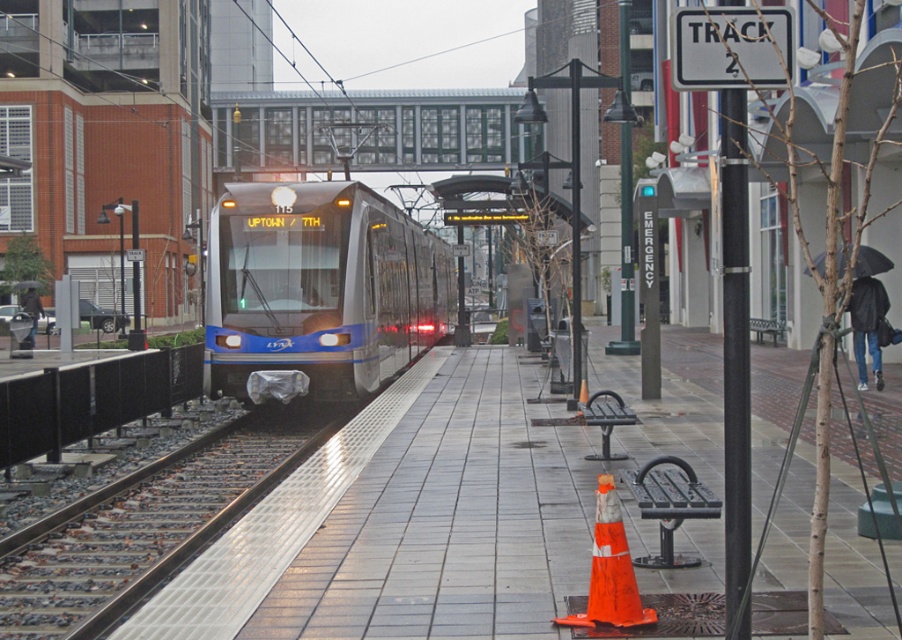
Who is taller, silver metallic train at center or orange matte traffic cone at lower center?

Standing taller between the two is silver metallic train at center.

Which of these two, silver metallic train at center or orange matte traffic cone at lower center, stands shorter?

With less height is orange matte traffic cone at lower center.

Between point (436, 280) and point (615, 500), which one is positioned behind?

The point (436, 280) is more distant.

The height and width of the screenshot is (640, 902). In order to click on silver metallic train at center in this screenshot , I will do `click(319, 289)`.

In the scene shown: Can you confirm if metal/textured track at lower left is shorter than orange matte traffic cone at lower center?

Yes.

Describe the element at coordinates (150, 529) in the screenshot. The width and height of the screenshot is (902, 640). I see `metal/textured track at lower left` at that location.

Find the location of a particular element. metal/textured track at lower left is located at coordinates (150, 529).

Is silver metallic train at center to the right of metal/textured track at lower left from the viewer's perspective?

Correct, you'll find silver metallic train at center to the right of metal/textured track at lower left.

Describe the element at coordinates (319, 289) in the screenshot. The width and height of the screenshot is (902, 640). I see `silver metallic train at center` at that location.

Find the location of a particular element. The height and width of the screenshot is (640, 902). silver metallic train at center is located at coordinates (319, 289).

Identify the location of silver metallic train at center. (319, 289).